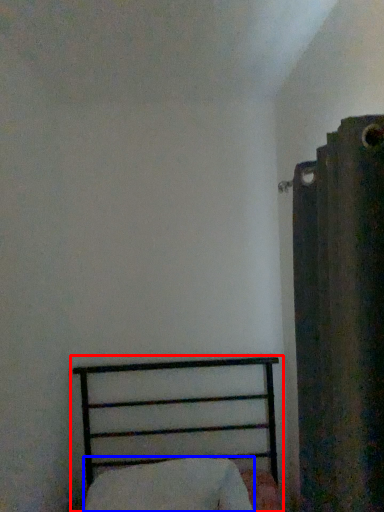
Question: Which object is closer to the camera taking this photo, bed (highlighted by a red box) or pillow (highlighted by a blue box)?

Choices:
 (A) bed
 (B) pillow

Answer: (A)